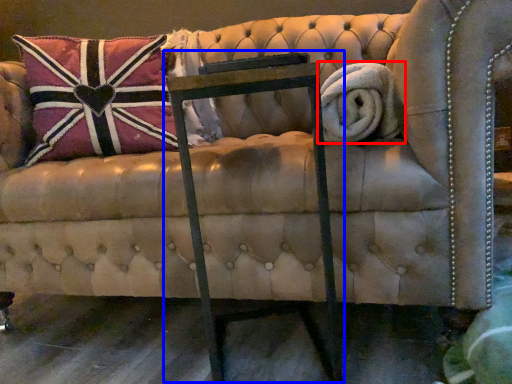
Question: Which object appears farthest to the camera in this image, bath towel (highlighted by a red box) or rocking chair (highlighted by a blue box)?

Choices:
 (A) bath towel
 (B) rocking chair

Answer: (A)